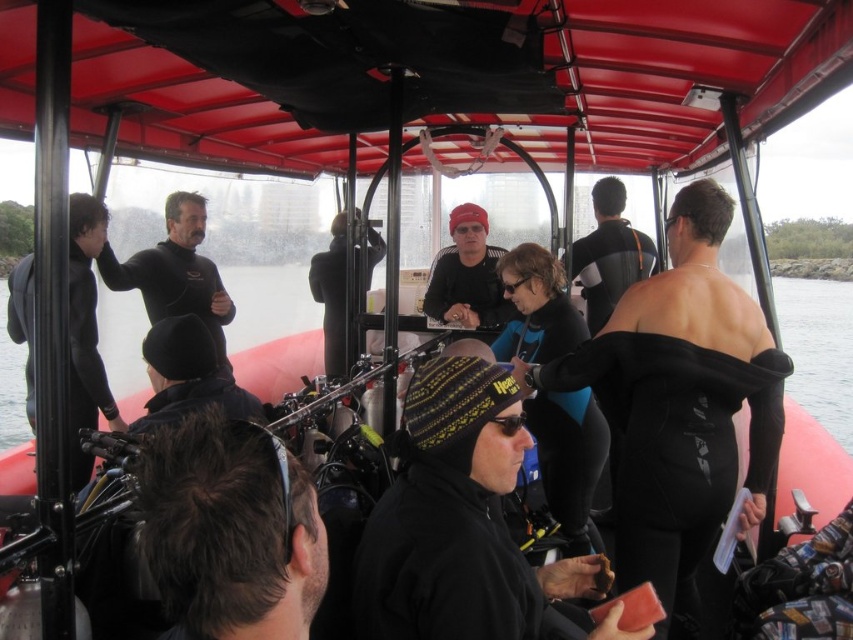
Who is positioned more to the left, black wetsuit at left or matte black beanie at center?

black wetsuit at left

Is black wetsuit at left smaller than matte black beanie at center?

Incorrect, black wetsuit at left is not smaller in size than matte black beanie at center.

Describe the element at coordinates (175, 273) in the screenshot. The height and width of the screenshot is (640, 853). I see `black wetsuit at left` at that location.

Locate an element on the screen. This screenshot has height=640, width=853. black wetsuit at left is located at coordinates (175, 273).